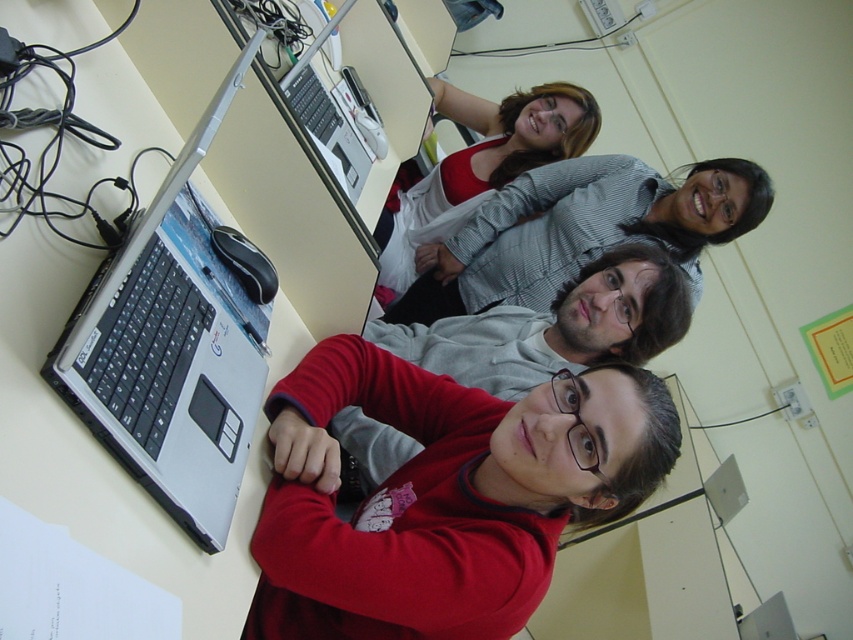
You are a photographer adjusting the camera angle to ensure both the striped shirt at center and the matte gray sweater at center are fully visible in the frame. Given their heights, which one might require you to lower the camera slightly to capture its full length?

The striped shirt at center is shorter than the matte gray sweater at center, so you would need to lower the camera slightly to ensure the shorter striped shirt at center is fully visible while still capturing the taller matte gray sweater at center.

From the picture: You are standing in the classroom and want to move from the point at coordinates (102, 272) to the point at (546, 104). Considering the perspective distortion in the image, will you need to walk forward or backward to reach your destination?

Since point (102, 272) is in front of point (546, 104), you will need to walk backward to reach the point at (546, 104) from the starting point at (102, 272).